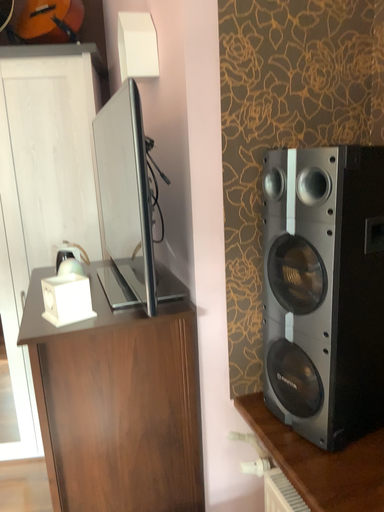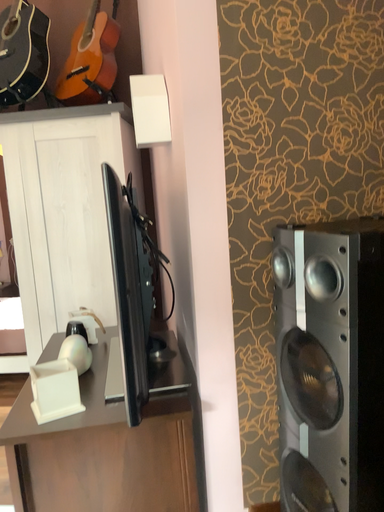
Question: How did the camera likely rotate when shooting the video?

Choices:
 (A) rotated left
 (B) rotated right

Answer: (A)